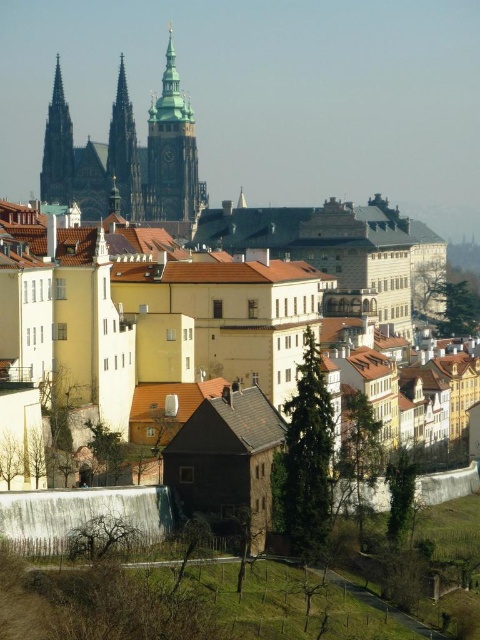
Question: Which of the following is the closest to the observer?

Choices:
 (A) (192, 170)
 (B) (49, 120)
 (C) (127, 125)

Answer: (B)

Question: Is golden stone spire at center in front of smooth stone spire at upper left?

Choices:
 (A) yes
 (B) no

Answer: (A)

Question: Is golden stone spire at center below smooth stone spire at upper left?

Choices:
 (A) yes
 (B) no

Answer: (A)

Question: Can you confirm if golden stone spire at center is smaller than smooth stone spire at upper left?

Choices:
 (A) yes
 (B) no

Answer: (B)

Question: Which is farther from the golden stone tower at center?

Choices:
 (A) smooth stone spire at upper left
 (B) golden stone spire at center

Answer: (A)

Question: Estimate the real-world distances between objects in this image. Which object is farther from the smooth stone spire at upper left?

Choices:
 (A) golden stone tower at center
 (B) golden stone spire at center

Answer: (A)